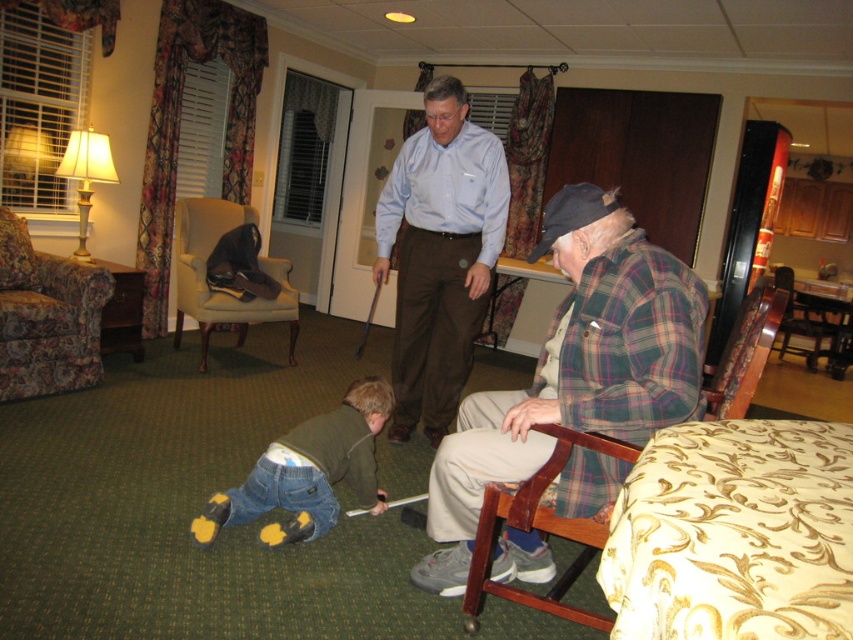
Question: Which of the following is the farthest from the observer?

Choices:
 (A) floral fabric armchair at left
 (B) light blue shirt at center
 (C) plaid flannel shirt at center
 (D) dark brown leather armchair at left

Answer: (D)

Question: Is woodenchair at right to the left of floral fabric armchair at left from the viewer's perspective?

Choices:
 (A) yes
 (B) no

Answer: (B)

Question: Where is light blue shirt at center located in relation to dark brown leather armchair at left in the image?

Choices:
 (A) right
 (B) left

Answer: (A)

Question: Can you confirm if floral fabric armchair at left is positioned to the right of dark brown leather armchair at left?

Choices:
 (A) yes
 (B) no

Answer: (B)

Question: Which point is farther from the camera taking this photo?

Choices:
 (A) (245, 483)
 (B) (473, 480)

Answer: (A)

Question: Which is nearer to the denim jeans at lower left?

Choices:
 (A) floral fabric armchair at left
 (B) dark brown leather armchair at left

Answer: (A)